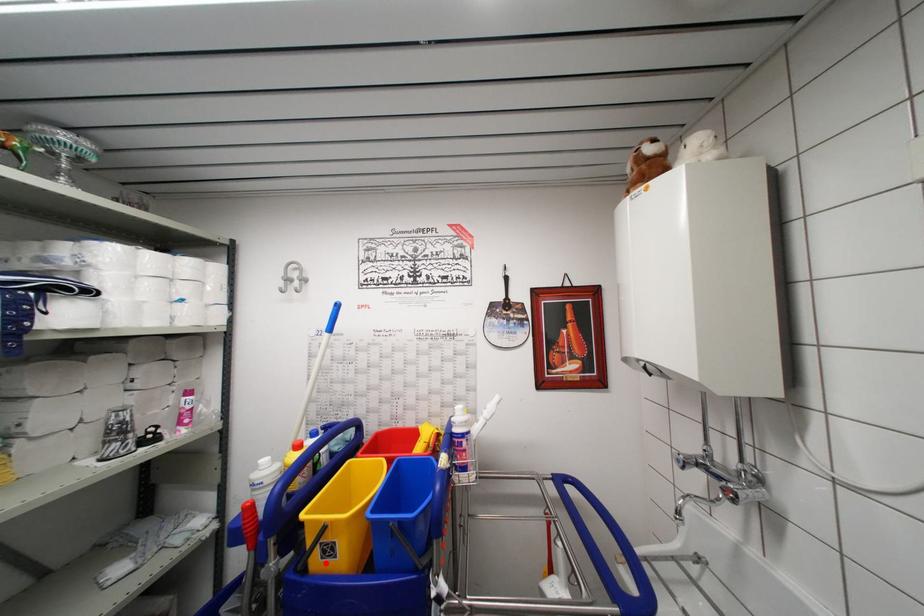
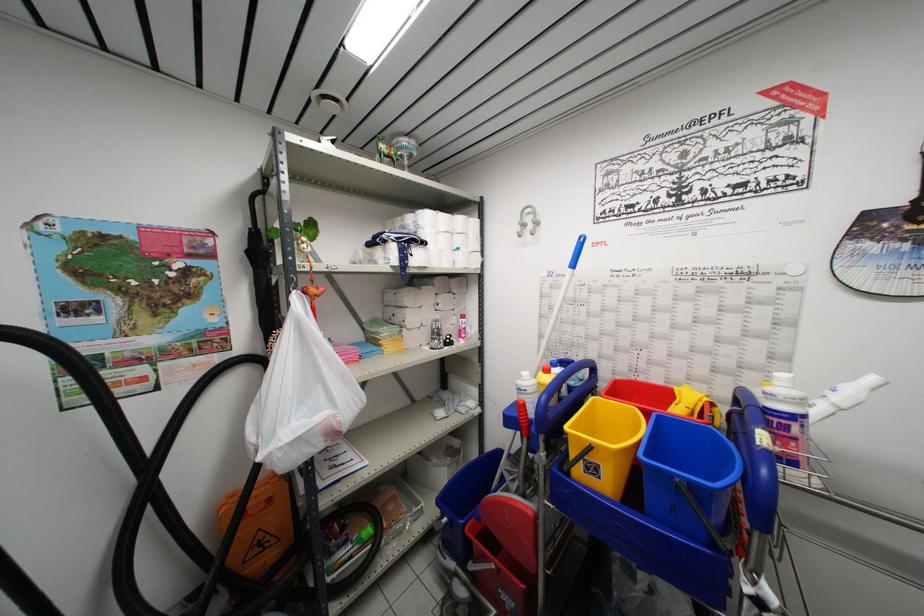
Find the pixel in the second image that matches the highlighted location in the first image.

(589, 477)